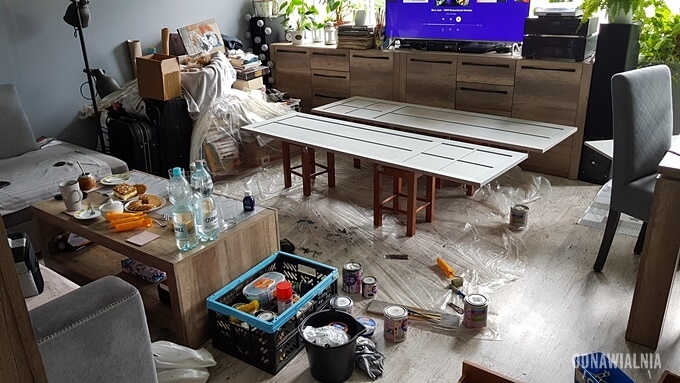
At what (x,y) coordinates should I click in order to perform the action: click on stools. Please return your answer as a coordinate pair (x, y). Looking at the image, I should click on (307, 170), (352, 163), (388, 196), (473, 190).